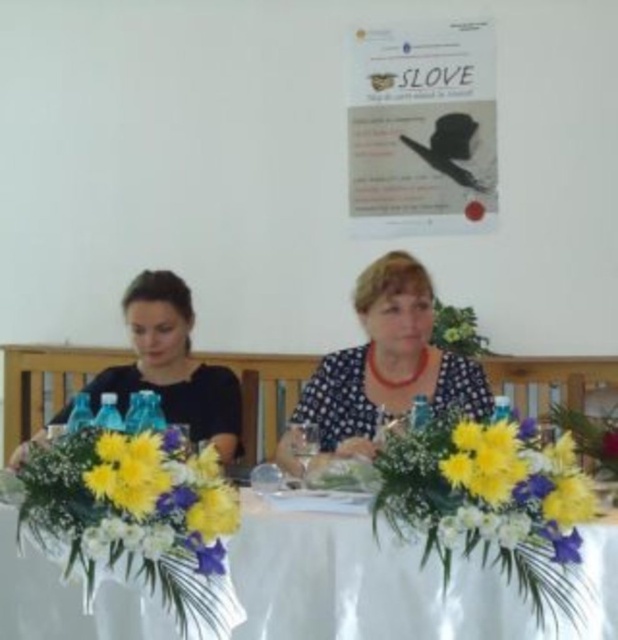
You are a photographer setting up for a formal event. You need to position a camera on the table so that it can capture both the white cloth table at center and the white floral arrangement at center clearly. Considering their heights, where should you place the camera to ensure both are in frame?

The white cloth table at center is taller than the white floral arrangement at center. To capture both clearly, position the camera at a height that accommodates the taller table and angle it slightly downward to include the floral arrangement below.

You are a photographer setting up for a formal event. You need to position a light source to the left of the white cloth table at center and to the right of the white floral arrangement at center. Is this possible based on the current setup?

The white cloth table at center is to the right of the white floral arrangement at center, so placing the light source to the left of the white cloth table at center and to the right of the white floral arrangement at center is possible as they are positioned in a way that allows space between them.